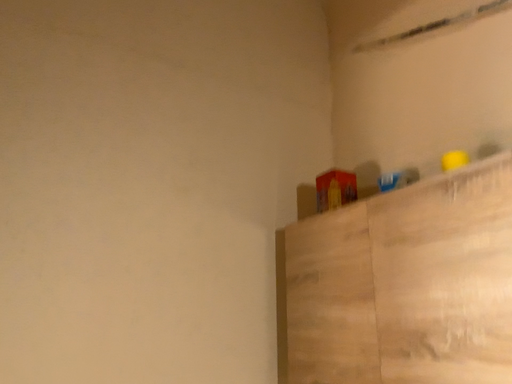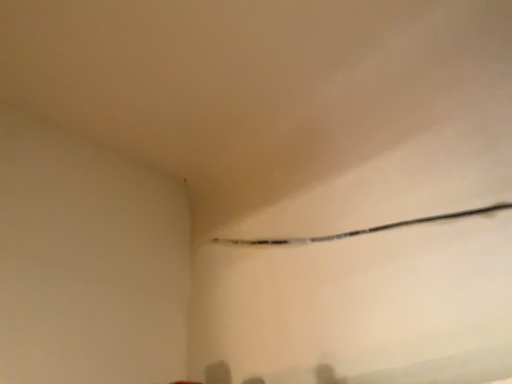
Question: How did the camera likely rotate when shooting the video?

Choices:
 (A) rotated left
 (B) rotated right

Answer: (B)